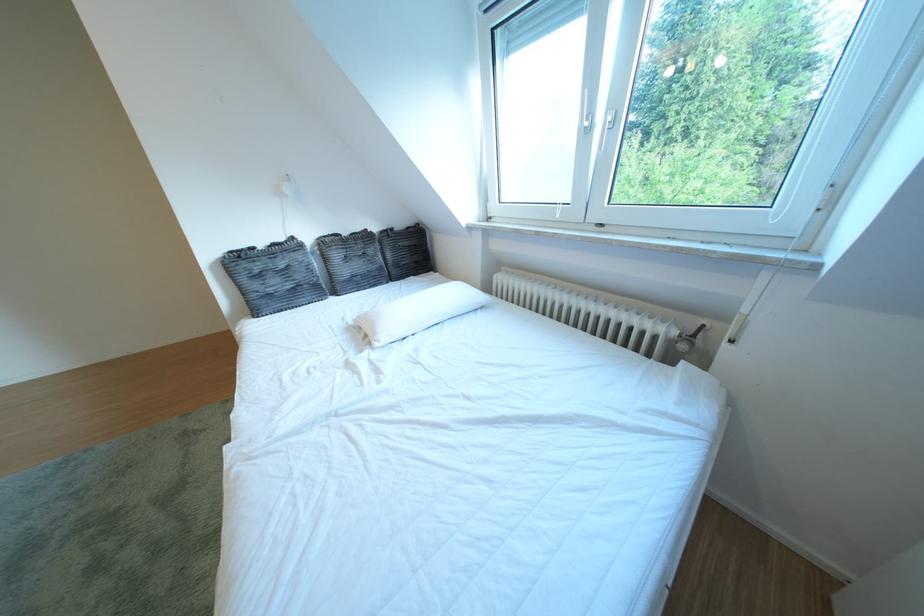
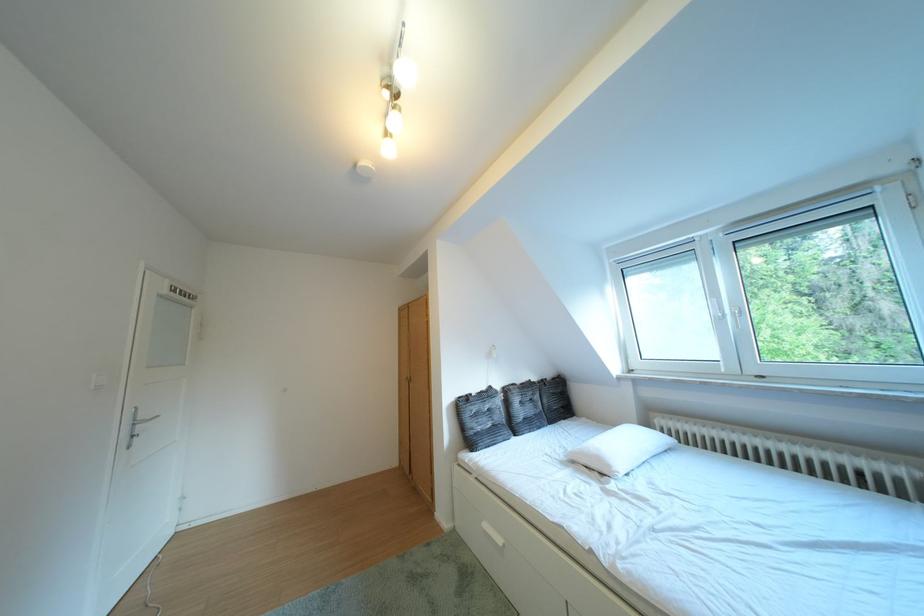
Find the pixel in the second image that matches point 307,243 in the first image.

(504, 392)